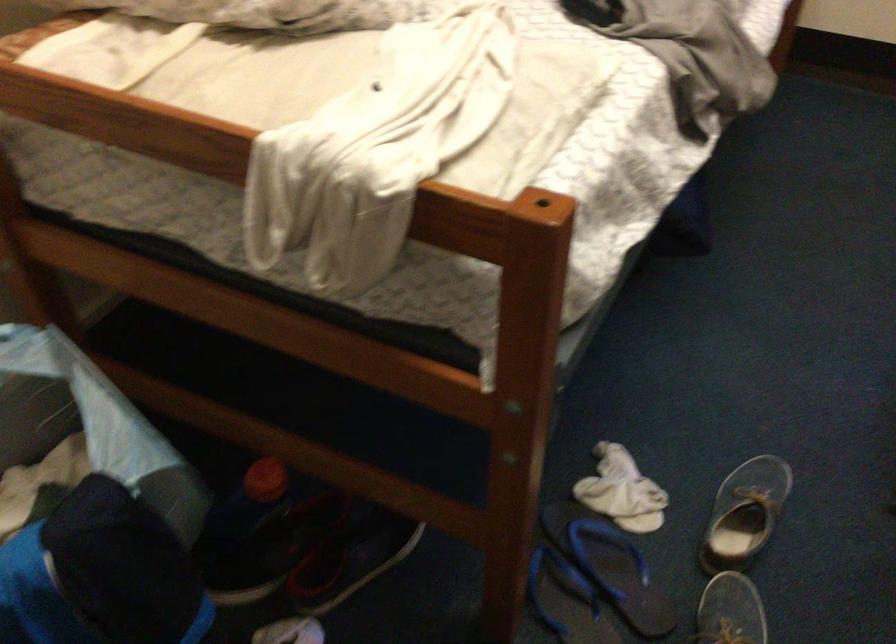
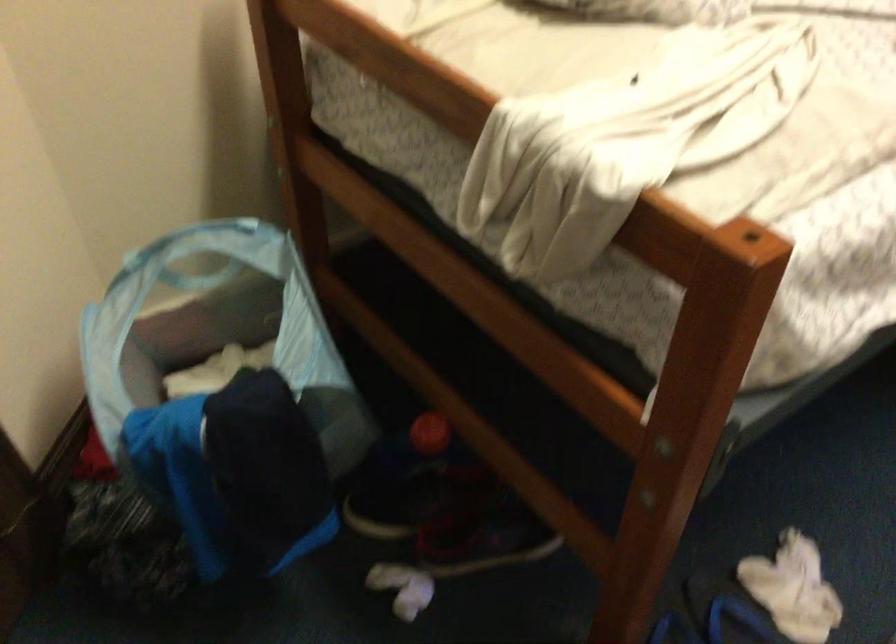
Question: The camera is either moving clockwise (left) or counter-clockwise (right) around the object. The first image is from the beginning of the video and the second image is from the end. Is the camera moving left or right when shooting the video?

Choices:
 (A) Left
 (B) Right

Answer: (B)